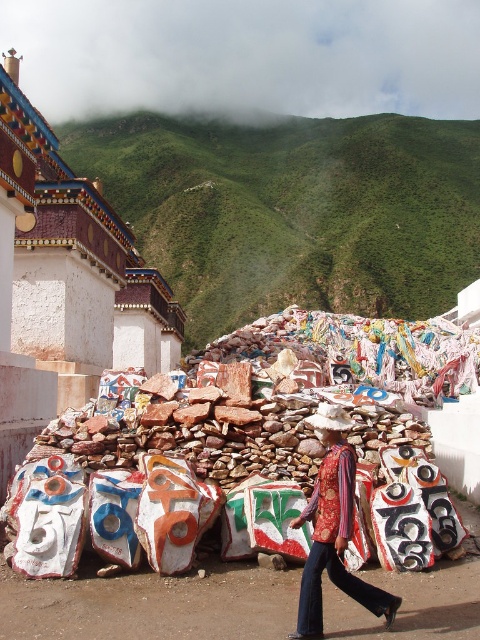
In the scene shown: You are a hiker who wants to place a small offering at the base of the white painted stone at upper left. However, there is a patterned fabric shirt at center in your path. Based on the scene, can you reach the stone without moving the shirt?

The white painted stone at upper left is further to the viewer than the patterned fabric shirt at center, so you can reach the stone without moving the shirt because it is closer to you than the shirt.

You are a hiker who wants to take a photo of the green grassy hillside at upper center and the patterned fabric shirt at center. Which object should you focus on first if you want both to be in clear focus?

The green grassy hillside at upper center is larger than the patterned fabric shirt at center, so you should focus on the larger object first to ensure both are in clear focus.